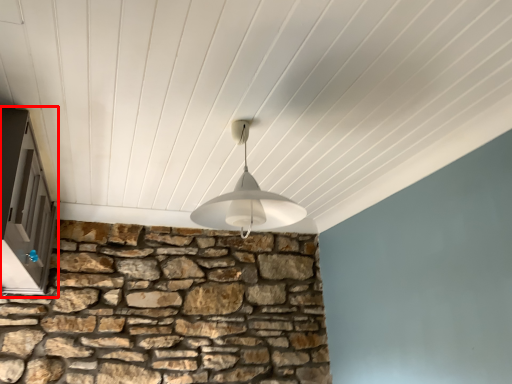
Question: In this image, where is window (annotated by the red box) located relative to lamp?

Choices:
 (A) left
 (B) right

Answer: (A)